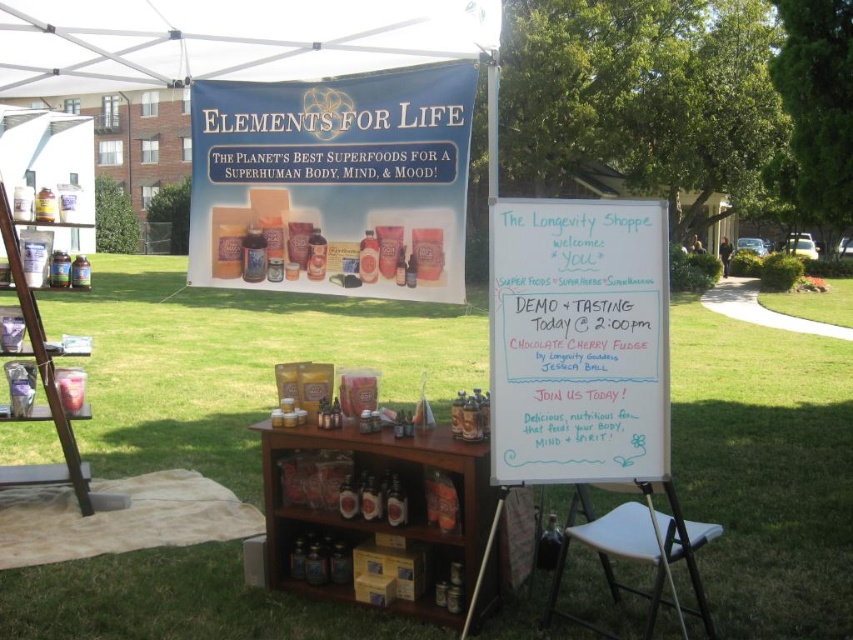
You are a photographer standing at the center of the tent, aiming to capture both the promotional banner and the product display table. The banner is at point (838, 492) and the table is at point (636, 502). Which object should you focus on first to ensure both are in sharp focus?

You should focus on the promotional banner at point (838, 492) first because it is closer to the camera than the product display table at point (636, 502). This ensures both will be in focus as the banner is nearer and the table is further away.

You are a photographer setting up for an outdoor event. You need to capture a photo where both the green grass at lower center and the white fabric canopy at upper center are visible. Given their sizes, which object should you focus on to ensure both are in frame without needing to adjust your camera angle?

The green grass at lower center has a larger size compared to the white fabric canopy at upper center. To include both in the frame, focus on the larger green grass at lower center and position it so that the smaller white fabric canopy at upper center fits within the same view.